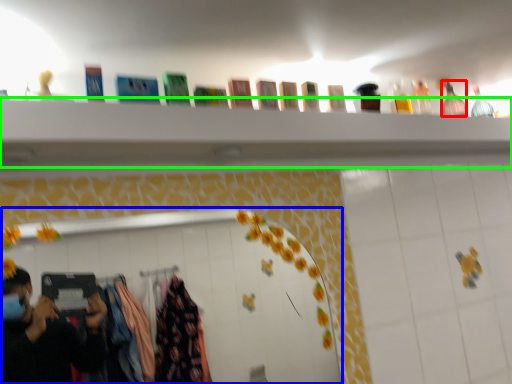
Question: Based on their relative distances, which object is farther from bottle (highlighted by a red box)? Choose from mirror (highlighted by a blue box) and closet (highlighted by a green box).

Choices:
 (A) mirror
 (B) closet

Answer: (A)